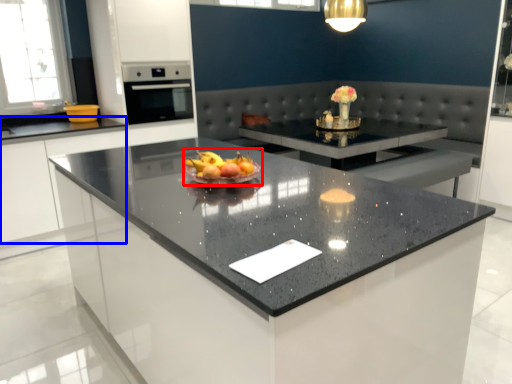
Question: Which of the following is the closest to the observer, fruit dish (highlighted by a red box) or cabinetry (highlighted by a blue box)?

Choices:
 (A) fruit dish
 (B) cabinetry

Answer: (A)